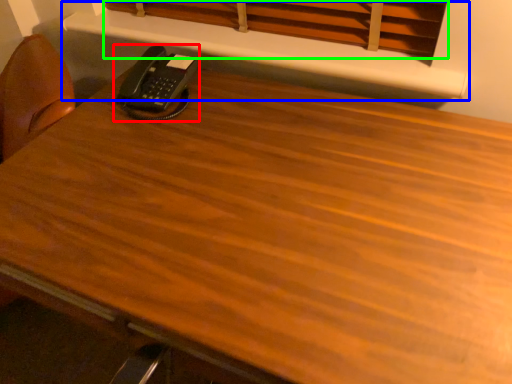
Question: Estimate the real-world distances between objects in this image. Which object is closer to corded phone (highlighted by a red box), shelf (highlighted by a blue box) or curtain (highlighted by a green box)?

Choices:
 (A) shelf
 (B) curtain

Answer: (A)